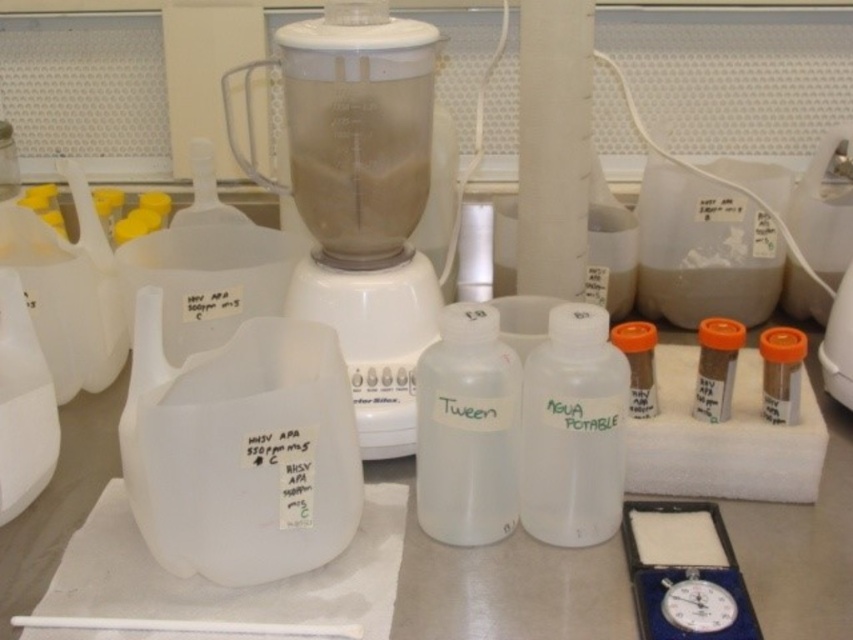
You are a researcher in the lab and need to locate the white matte bottle at center. According to the scene description, where exactly is it positioned?

The white matte bottle at center is located at point (573, 429).